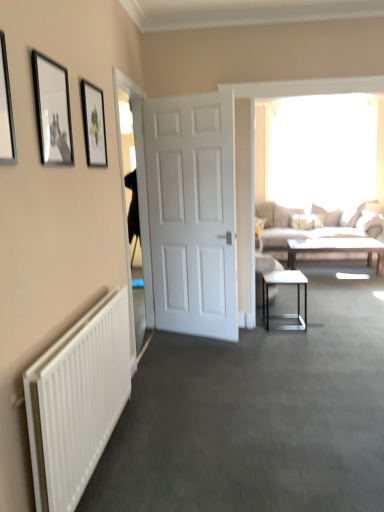
Question: Is beige fabric couch at right positioned behind transparent glass door at left?

Choices:
 (A) yes
 (B) no

Answer: (A)

Question: Considering the relative sizes of beige fabric couch at right and transparent glass door at left in the image provided, is beige fabric couch at right shorter than transparent glass door at left?

Choices:
 (A) yes
 (B) no

Answer: (A)

Question: Is the depth of beige fabric couch at right less than that of transparent glass door at left?

Choices:
 (A) no
 (B) yes

Answer: (A)

Question: Considering the relative positions of beige fabric couch at right and transparent glass door at left in the image provided, is beige fabric couch at right to the right of transparent glass door at left from the viewer's perspective?

Choices:
 (A) no
 (B) yes

Answer: (B)

Question: From the image's perspective, would you say beige fabric couch at right is shown under transparent glass door at left?

Choices:
 (A) yes
 (B) no

Answer: (B)

Question: From the image's perspective, is matte black picture frame at upper left, which ranks as the 1th picture frame in right-to-left order, located above or below black matte picture frame at upper left, which is the 2th picture frame in front-to-back order?

Choices:
 (A) above
 (B) below

Answer: (A)

Question: Relative to black matte picture frame at upper left, placed as the 2th picture frame when sorted from left to right, is matte black picture frame at upper left, placed as the third picture frame when sorted from front to back, in front or behind?

Choices:
 (A) front
 (B) behind

Answer: (B)

Question: Considering the relative positions of matte black picture frame at upper left, the 1th picture frame from the back, and black matte picture frame at upper left, placed as the 2th picture frame when sorted from left to right, in the image provided, is matte black picture frame at upper left, the 1th picture frame from the back, to the left or to the right of black matte picture frame at upper left, placed as the 2th picture frame when sorted from left to right,?

Choices:
 (A) left
 (B) right

Answer: (B)

Question: Is matte black picture frame at upper left, the 1th picture frame from the back, wider or thinner than black matte picture frame at upper left, placed as the 2th picture frame when sorted from left to right?

Choices:
 (A) thin
 (B) wide

Answer: (B)

Question: From the image's perspective, is matte black picture frame at upper left, placed as the third picture frame when sorted from front to back, positioned above or below light brown wooden coffee table at center?

Choices:
 (A) below
 (B) above

Answer: (B)

Question: In terms of height, does matte black picture frame at upper left, which ranks as the 1th picture frame in right-to-left order, look taller or shorter compared to light brown wooden coffee table at center?

Choices:
 (A) short
 (B) tall

Answer: (B)

Question: From a real-world perspective, is matte black picture frame at upper left, placed as the third picture frame when sorted from front to back, above or below light brown wooden coffee table at center?

Choices:
 (A) above
 (B) below

Answer: (A)

Question: Is point (102, 96) closer or farther from the camera than point (367, 257)?

Choices:
 (A) closer
 (B) farther

Answer: (A)

Question: Would you say black matte picture frame at upper left, marked as the second picture frame in a right-to-left arrangement, is inside or outside transparent glass window at upper center?

Choices:
 (A) outside
 (B) inside

Answer: (A)

Question: Is black matte picture frame at upper left, marked as the second picture frame in a right-to-left arrangement, wider or thinner than transparent glass window at upper center?

Choices:
 (A) wide
 (B) thin

Answer: (B)